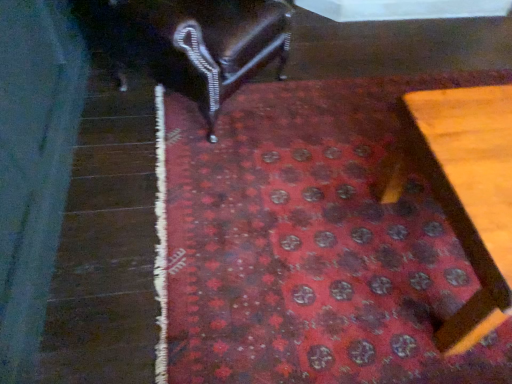
Question: Looking at their shapes, would you say red carpet at center is wider or thinner than shiny dark wood chair at upper left, arranged as the 1th furniture when viewed from the top?

Choices:
 (A) wide
 (B) thin

Answer: (A)

Question: Is red carpet at center situated inside shiny dark wood chair at upper left, arranged as the 1th furniture when viewed from the top, or outside?

Choices:
 (A) inside
 (B) outside

Answer: (B)

Question: Based on their relative distances, which object is farther from the shiny dark wood chair at upper left, arranged as the 1th furniture when viewed from the top?

Choices:
 (A) red carpet at center
 (B) wooden table at lower right, the 1th furniture in the bottom-to-top sequence

Answer: (B)

Question: Which object is positioned closest to the wooden table at lower right, the second furniture in the left-to-right sequence?

Choices:
 (A) red carpet at center
 (B) shiny dark wood chair at upper left, placed as the first furniture when sorted from left to right

Answer: (A)